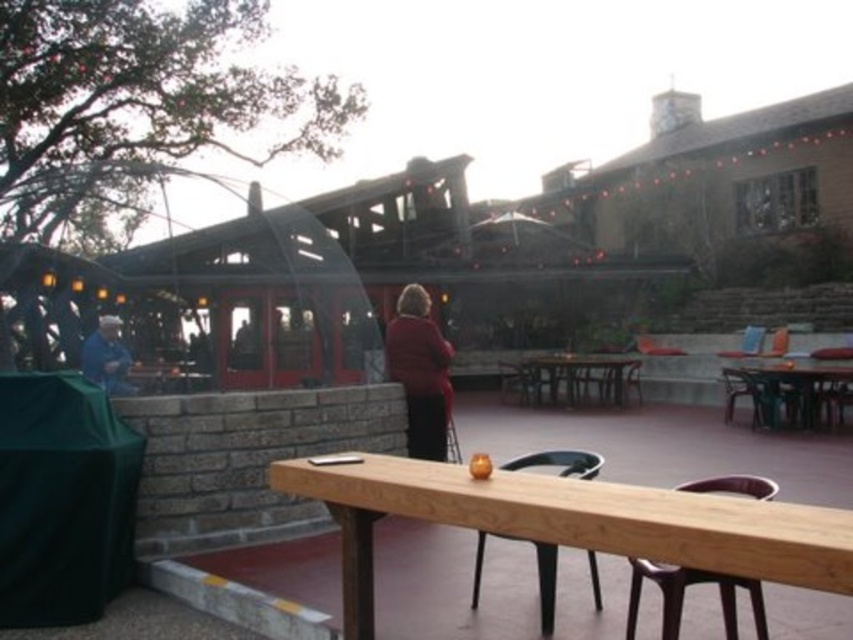
You are a painter standing at the edge of the seating area, and you want to place a 1.2 meter tall easel between the wooden picnic table at center and the blue fabric at left. Can the easel fit vertically between them without hitting either object?

The wooden picnic table at center is taller than the blue fabric at left. Since the easel is 1.2 meters tall, it might hit the taller wooden picnic table at center if placed between them. Check the height clearance before setting up.

You are standing at the point marked as point (416, 404) in the image. You want to walk to the entrance of the restaurant located 6.72 meters away from your current position. Is there any obstacle between you and the entrance?

The entrance is 6.72 meters away from point (416, 404), so there are no obstacles between you and the entrance since the distance matches exactly.

You are standing in the outdoor seating area and want to place a small plant between the two points marked as point (839,381) and point (570,362). Which point should the plant be closer to in order to be nearer to you?

The plant should be placed closer to point (839,381) because it is closer to the viewer than point (570,362).